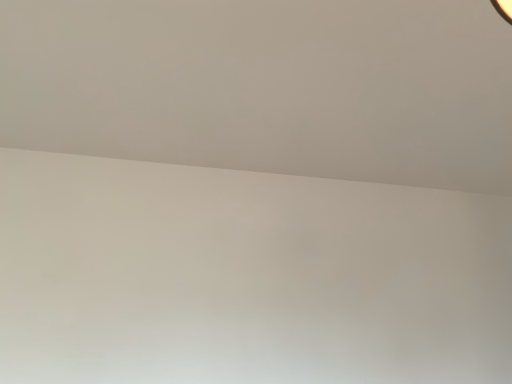
Question: Should I look upward or downward to see white matte wall at upper center?

Choices:
 (A) down
 (B) up

Answer: (B)